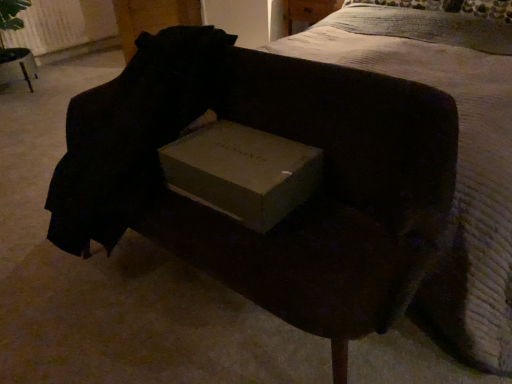
What do you see at coordinates (130, 135) in the screenshot?
I see `matte cardboard box at center` at bounding box center [130, 135].

Where is `white textured bed at upper center`? The width and height of the screenshot is (512, 384). white textured bed at upper center is located at coordinates (457, 145).

The height and width of the screenshot is (384, 512). What do you see at coordinates (457, 145) in the screenshot?
I see `white textured bed at upper center` at bounding box center [457, 145].

This screenshot has width=512, height=384. What do you see at coordinates (242, 172) in the screenshot?
I see `matte cardboard box at center` at bounding box center [242, 172].

Identify the location of matte cardboard box at center. Image resolution: width=512 pixels, height=384 pixels. (130, 135).

From the picture: Is white textured bed at upper center in contact with matte cardboard box at center?

white textured bed at upper center and matte cardboard box at center are clearly separated.

Which object is closer to the camera taking this photo, white textured bed at upper center or matte cardboard box at center?

white textured bed at upper center is closer to the camera.

This screenshot has width=512, height=384. Find the location of `bed that is on the right side of matte cardboard box at center`. bed that is on the right side of matte cardboard box at center is located at coordinates (457, 145).

Between matte cardboard box at center and matte cardboard box at center, which one is positioned in front?

matte cardboard box at center.

Is matte cardboard box at center bigger than matte cardboard box at center?

No.

From a real-world perspective, is matte cardboard box at center positioned over matte cardboard box at center based on gravity?

Yes, from a real-world perspective, matte cardboard box at center is on top of matte cardboard box at center.

Based on the photo, can white textured bed at upper center be found inside matte cardboard box at center?

No, white textured bed at upper center is located outside of matte cardboard box at center.

Is point (177, 49) closer or farther from the camera than point (432, 311)?

Clearly, point (177, 49) is more distant from the camera than point (432, 311).

Considering the relative sizes of matte cardboard box at center and white textured bed at upper center in the image provided, is matte cardboard box at center shorter than white textured bed at upper center?

Yes, matte cardboard box at center is shorter than white textured bed at upper center.

Considering the positions of objects matte cardboard box at center and white textured bed at upper center in the image provided, who is behind, matte cardboard box at center or white textured bed at upper center?

matte cardboard box at center is more distant.

Is matte cardboard box at center positioned behind matte cardboard box at center?

That is False.

How distant is matte cardboard box at center from matte cardboard box at center?

matte cardboard box at center is 11.87 inches away from matte cardboard box at center.

How many degrees apart are the facing directions of matte cardboard box at center and matte cardboard box at center?

The angle between the facing direction of matte cardboard box at center and the facing direction of matte cardboard box at center is 0.00105 degrees.

Is matte cardboard box at center not near matte cardboard box at center?

No, there isn't a large distance between matte cardboard box at center and matte cardboard box at center.

How distant is matte cardboard box at center from white textured bed at upper center?

They are 32.87 inches apart.

Which object is thinner, matte cardboard box at center or white textured bed at upper center?

matte cardboard box at center.

In terms of size, does matte cardboard box at center appear bigger or smaller than white textured bed at upper center?

Considering their sizes, matte cardboard box at center takes up less space than white textured bed at upper center.

From the image's perspective, is white textured bed at upper center above or below matte cardboard box at center?

Based on their image positions, white textured bed at upper center is located above matte cardboard box at center.

Considering the sizes of objects white textured bed at upper center and matte cardboard box at center in the image provided, who is smaller, white textured bed at upper center or matte cardboard box at center?

With smaller size is matte cardboard box at center.

Does white textured bed at upper center come behind matte cardboard box at center?

No, white textured bed at upper center is closer to the camera.

Does white textured bed at upper center have a greater height compared to matte cardboard box at center?

Yes.

This screenshot has height=384, width=512. Find the location of `box below the white textured bed at upper center (from the image's perspective)`. box below the white textured bed at upper center (from the image's perspective) is located at coordinates (242, 172).

Locate an element on the screen. the back that appears above the matte cardboard box at center (from the image's perspective) is located at coordinates (130, 135).

Estimate the real-world distances between objects in this image. Which object is further from white textured bed at upper center, matte cardboard box at center or matte cardboard box at center?

The object further to white textured bed at upper center is matte cardboard box at center.

From the image, which object appears to be farther from matte cardboard box at center, matte cardboard box at center or white textured bed at upper center?

white textured bed at upper center is positioned further to the anchor matte cardboard box at center.

When comparing their distances from white textured bed at upper center, does matte cardboard box at center or matte cardboard box at center seem closer?

Based on the image, matte cardboard box at center appears to be nearer to white textured bed at upper center.

Which object lies nearer to the anchor point matte cardboard box at center, white textured bed at upper center or matte cardboard box at center?

matte cardboard box at center is closer to matte cardboard box at center.

When comparing their distances from matte cardboard box at center, does white textured bed at upper center or matte cardboard box at center seem further?

The object further to matte cardboard box at center is white textured bed at upper center.

Considering their positions, is matte cardboard box at center positioned further to matte cardboard box at center than white textured bed at upper center?

Among the two, white textured bed at upper center is located further to matte cardboard box at center.

Where is `box between matte cardboard box at center and white textured bed at upper center in the horizontal direction`? The width and height of the screenshot is (512, 384). box between matte cardboard box at center and white textured bed at upper center in the horizontal direction is located at coordinates (242, 172).